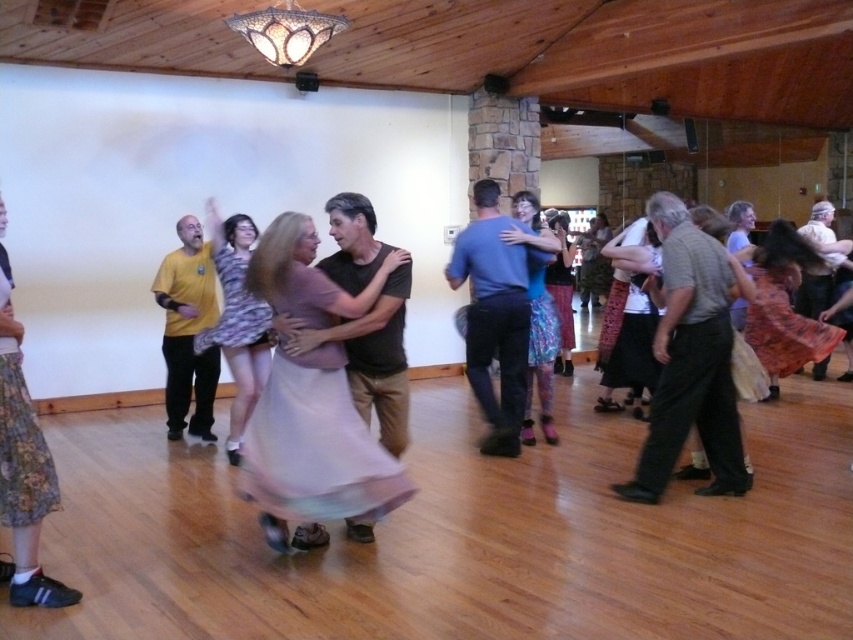
You are standing in the dance hall and want to reach the point marked at coordinates (506,371). If you are currently 5 meters away from that point, can you move forward to reach it?

The distance of point (506,371) from viewer is 4.85 meters, so you are currently 5 meters away, which is slightly further than the actual distance. You can move forward approximately 0.15 meters to reach it.

You are standing in the dance hall and see two points marked on the floor. One is at point coordinates point [474,314] and the other is at point [15,362]. Which point is closer to you?

Result: Point [15,362] is closer to you because it is nearer to the camera than point [474,314].